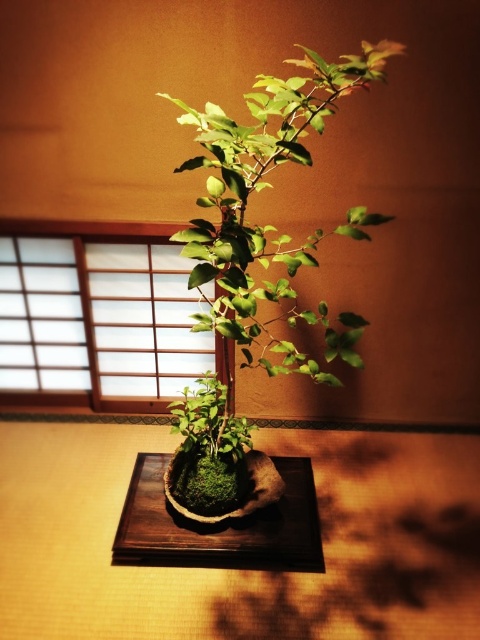
Does green mossy pot at center have a greater width compared to dark brown wooden tray at center?

Yes, green mossy pot at center is wider than dark brown wooden tray at center.

Is green mossy pot at center to the right of dark brown wooden tray at center from the viewer's perspective?

Correct, you'll find green mossy pot at center to the right of dark brown wooden tray at center.

Image resolution: width=480 pixels, height=640 pixels. Identify the location of green mossy pot at center. (269, 225).

Identify the location of green mossy pot at center. This screenshot has height=640, width=480. (269, 225).